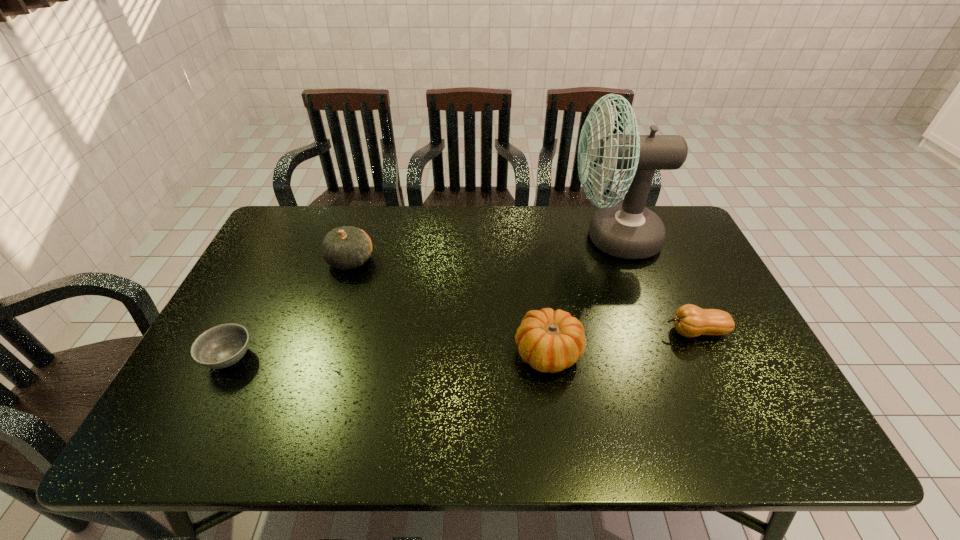
Locate an element on the screen. fan that is at the right edge is located at coordinates (629, 230).

I want to click on gourd that is at the right edge, so click(689, 320).

This screenshot has width=960, height=540. In order to click on object at the far right corner in this screenshot , I will do `click(629, 230)`.

In order to click on vacant space at the far edge of the desktop in this screenshot , I will do `click(549, 222)`.

Where is `vacant space at the near edge of the desktop`? The image size is (960, 540). vacant space at the near edge of the desktop is located at coordinates click(x=246, y=448).

I want to click on vacant space at the left edge, so click(252, 323).

Find the location of a particular element. free region at the right edge of the desktop is located at coordinates (673, 261).

In the image, there is a desktop. At what (x,y) coordinates should I click in order to perform the action: click on vacant space at the near right corner. Please return your answer as a coordinate pair (x, y). The image size is (960, 540). Looking at the image, I should click on (742, 436).

Locate an element on the screen. vacant point located between the second gourd from left to right and the shortest gourd is located at coordinates (622, 342).

Where is `vacant area that lies between the shortest object and the second object from left to right`? The height and width of the screenshot is (540, 960). vacant area that lies between the shortest object and the second object from left to right is located at coordinates (290, 309).